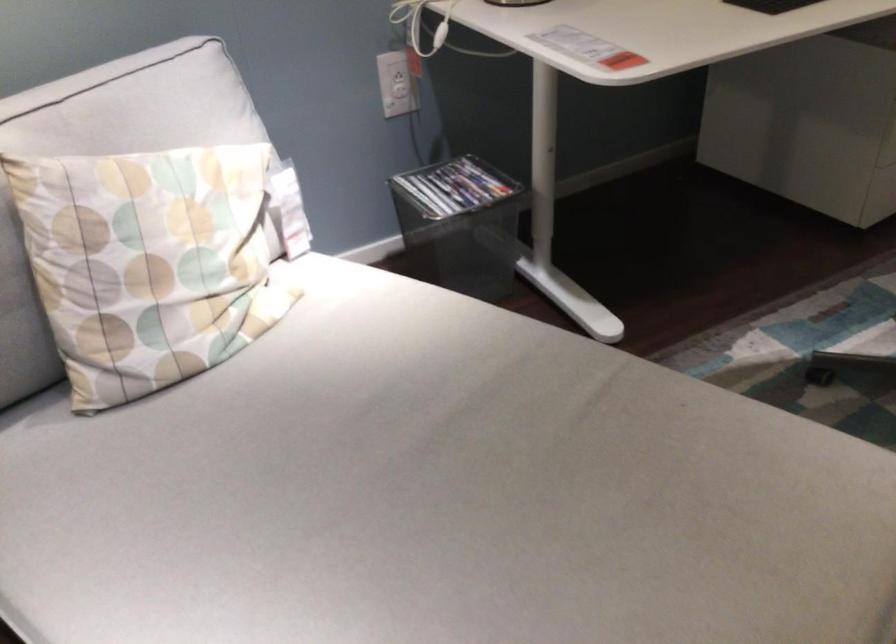
Locate an element on the screen. This screenshot has width=896, height=644. magazine in bin is located at coordinates (454, 187).